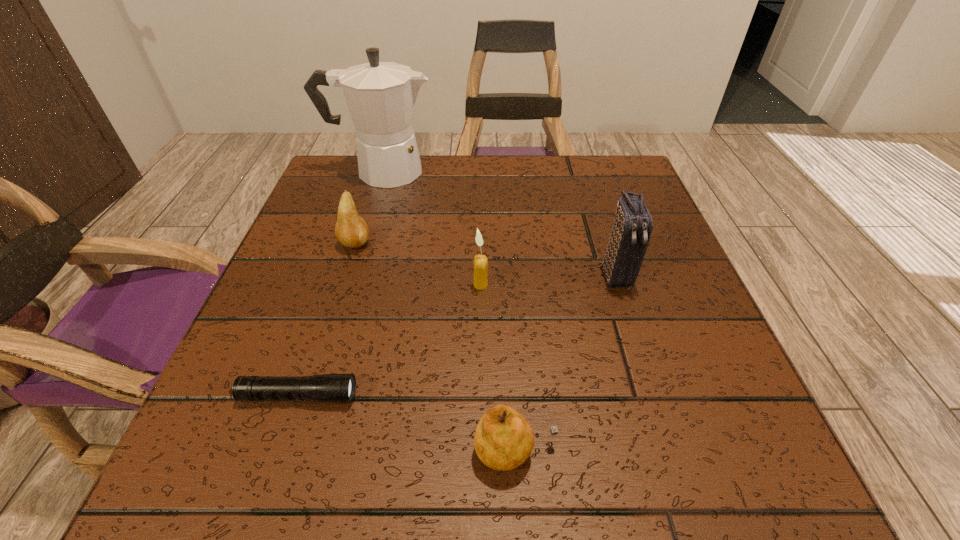
Find the location of `object that can be found as the fourth closest to the clutch bag`. object that can be found as the fourth closest to the clutch bag is located at coordinates (351, 230).

Identify which object is the second nearest to the second shortest object. Please provide its 2D coordinates. Your answer should be formatted as a tuple, i.e. [(x, y)], where the tuple contains the x and y coordinates of a point satisfying the conditions above.

[(480, 264)]

The height and width of the screenshot is (540, 960). Find the location of `free space that satisfies the following two spatial constraints: 1. at the spout of the coffeepot; 2. on the left side of the shorter pear`. free space that satisfies the following two spatial constraints: 1. at the spout of the coffeepot; 2. on the left side of the shorter pear is located at coordinates (295, 451).

You are a GUI agent. You are given a task and a screenshot of the screen. Output one action in this format:
    pyautogui.click(x=<x>, y=<y>)
    Task: Click on the vacant point that satisfies the following two spatial constraints: 1. with the zip open on the fifth shortest object; 2. at the lens end of the shortest object
    This screenshot has height=540, width=960.
    Given the screenshot: What is the action you would take?
    pyautogui.click(x=655, y=396)

At what (x,y) coordinates should I click in order to perform the action: click on vacant space that satisfies the following two spatial constraints: 1. with the zip open on the clutch bag; 2. at the lens end of the flashlight. Please return your answer as a coordinate pair (x, y). The height and width of the screenshot is (540, 960). Looking at the image, I should click on click(655, 396).

Locate an element on the screen. The width and height of the screenshot is (960, 540). free point that satisfies the following two spatial constraints: 1. at the spout of the tallest object; 2. on the left side of the nearest object is located at coordinates (295, 451).

Where is `free space that satisfies the following two spatial constraints: 1. on the front side of the farther pear; 2. on the right side of the candle`? The width and height of the screenshot is (960, 540). free space that satisfies the following two spatial constraints: 1. on the front side of the farther pear; 2. on the right side of the candle is located at coordinates (342, 285).